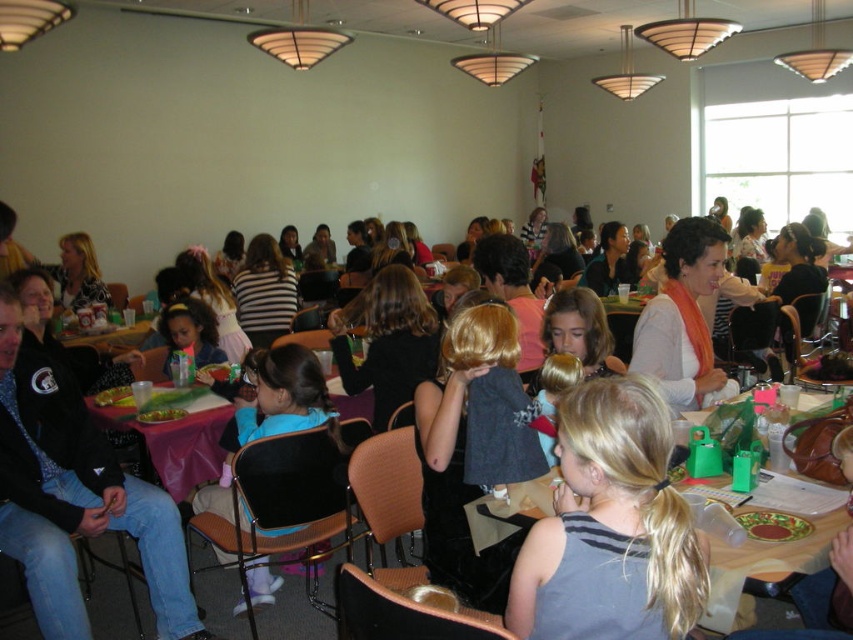
Can you confirm if matte plastic table at center is positioned above green leafy salad at center?

Actually, matte plastic table at center is below green leafy salad at center.

Is point (630, 403) closer to viewer compared to point (186, 412)?

Yes, point (630, 403) is in front of point (186, 412).

Between point (566, 577) and point (171, 410), which one is positioned in front?

Point (566, 577)

Identify the location of matte plastic table at center. (612, 524).

Between point (216, 358) and point (138, 413), which one is positioned in front?

Point (138, 413) is more forward.

Where is `matte plastic cup at center`? matte plastic cup at center is located at coordinates (190, 332).

Is point (641, 406) positioned before point (132, 556)?

Yes, point (641, 406) is in front of point (132, 556).

Is matte plastic table at center positioned at the back of matte black jacket at center?

No, matte plastic table at center is closer to the viewer.

Who is more forward, (625, 538) or (64, 401)?

Positioned in front is point (625, 538).

At what (x,y) coordinates should I click in order to perform the action: click on matte plastic table at center. Please return your answer as a coordinate pair (x, y). The width and height of the screenshot is (853, 640). Looking at the image, I should click on (612, 524).